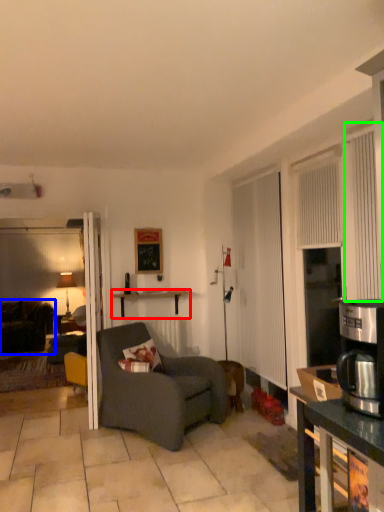
Question: Which object is positioned farthest from desk (highlighted by a red box)? Select from studio couch (highlighted by a blue box) and curtain (highlighted by a green box).

Choices:
 (A) studio couch
 (B) curtain

Answer: (B)